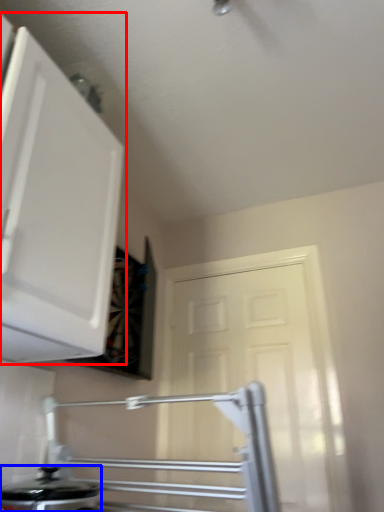
Question: Which object is further to the camera taking this photo, cabinetry (highlighted by a red box) or kitchen appliance (highlighted by a blue box)?

Choices:
 (A) cabinetry
 (B) kitchen appliance

Answer: (B)